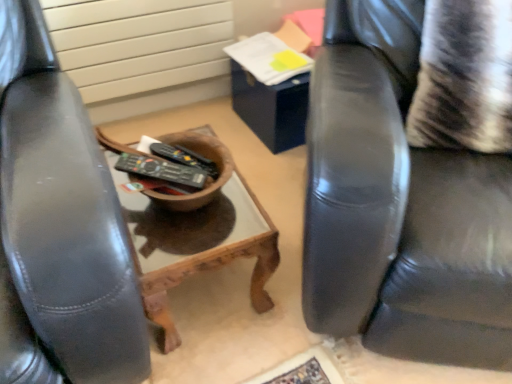
What do you see at coordinates (161, 170) in the screenshot? The image size is (512, 384). I see `black plastic remote control at center, which is the first remote control from front to back` at bounding box center [161, 170].

Describe the element at coordinates (464, 77) in the screenshot. I see `striped fabric pillow at right` at that location.

Describe the element at coordinates (199, 234) in the screenshot. The height and width of the screenshot is (384, 512). I see `woodenobject at center` at that location.

Image resolution: width=512 pixels, height=384 pixels. What are the coordinates of `black plastic remote control at center, the second remote control in the front-to-back sequence` in the screenshot? It's located at (184, 157).

Considering the positions of objects striped fabric pillow at right and woodenobject at center in the image provided, who is more to the left, striped fabric pillow at right or woodenobject at center?

Positioned to the left is woodenobject at center.

From the image's perspective, does striped fabric pillow at right appear higher than woodenobject at center?

Yes, from the image's perspective, striped fabric pillow at right is over woodenobject at center.

Choose the correct answer: Is striped fabric pillow at right inside woodenobject at center or outside it?

striped fabric pillow at right is spatially situated outside woodenobject at center.

Is white textured radiator at upper left further to the viewer compared to woodenobject at center?

Yes, it is.

Can you confirm if white textured radiator at upper left is shorter than woodenobject at center?

No, white textured radiator at upper left is not shorter than woodenobject at center.

Considering the relative positions of white textured radiator at upper left and woodenobject at center in the image provided, is white textured radiator at upper left to the left or to the right of woodenobject at center?

Clearly, white textured radiator at upper left is on the left of woodenobject at center in the image.

In order to click on table below the white textured radiator at upper left (from a real-world perspective) in this screenshot , I will do `click(199, 234)`.

Is white textured radiator at upper left bigger or smaller than black leather chair at right?

Clearly, white textured radiator at upper left is smaller in size than black leather chair at right.

Is white textured radiator at upper left looking in the opposite direction of black leather chair at right?

No, white textured radiator at upper left is not facing the opposite direction of black leather chair at right.

Is white textured radiator at upper left at the left side of black leather chair at right?

Indeed, white textured radiator at upper left is positioned on the left side of black leather chair at right.

Is the depth of black leather chair at right less than that of black plastic remote control at center, which is the first remote control from front to back?

That is True.

From the image's perspective, is black leather chair at right located above black plastic remote control at center, which ranks as the 2th remote control in back-to-front order?

Yes.

Is black leather chair at right looking in the opposite direction of black plastic remote control at center, which ranks as the 2th remote control in back-to-front order?

That's not correct — black leather chair at right is not looking away from black plastic remote control at center, which ranks as the 2th remote control in back-to-front order.

How different are the orientations of black leather chair at right and black plastic remote control at center, which is the first remote control from front to back, in degrees?

82 degrees separate the facing orientations of black leather chair at right and black plastic remote control at center, which is the first remote control from front to back.

Is white textured radiator at upper left far from black plastic remote control at center, the 1th remote control in the back-to-front sequence?

No, there isn't a large distance between white textured radiator at upper left and black plastic remote control at center, the 1th remote control in the back-to-front sequence.

Is white textured radiator at upper left aimed at black plastic remote control at center, the second remote control in the front-to-back sequence?

Yes, white textured radiator at upper left faces towards black plastic remote control at center, the second remote control in the front-to-back sequence.

Considering the relative sizes of white textured radiator at upper left and black plastic remote control at center, the second remote control in the front-to-back sequence, in the image provided, is white textured radiator at upper left taller than black plastic remote control at center, the second remote control in the front-to-back sequence,?

Yes, white textured radiator at upper left is taller than black plastic remote control at center, the second remote control in the front-to-back sequence.

Can you confirm if black leather chair at right is taller than black plastic remote control at center, the 1th remote control in the back-to-front sequence?

Yes.

Looking at this image, does black leather chair at right have a larger size compared to black plastic remote control at center, the second remote control in the front-to-back sequence?

Yes, black leather chair at right is bigger than black plastic remote control at center, the second remote control in the front-to-back sequence.

Does black leather chair at right turn towards black plastic remote control at center, the 1th remote control in the back-to-front sequence?

No, black leather chair at right is not aimed at black plastic remote control at center, the 1th remote control in the back-to-front sequence.

Is woodenobject at center not within black leather chair at right?

Yes, woodenobject at center is located beyond the bounds of black leather chair at right.

Does woodenobject at center turn towards black leather chair at right?

No, woodenobject at center is not turned towards black leather chair at right.

Consider the image. Is woodenobject at center shorter than black leather chair at right?

Correct, woodenobject at center is not as tall as black leather chair at right.

From a real-world perspective, which is physically above, woodenobject at center or black leather chair at right?

black leather chair at right, from a real-world perspective.

Locate an element on the screen. This screenshot has height=384, width=512. pillow to the right of woodenobject at center is located at coordinates (464, 77).

Find the location of a particular element. table below the white textured radiator at upper left (from the image's perspective) is located at coordinates (199, 234).

Estimate the real-world distances between objects in this image. Which object is further from black plastic remote control at center, the 1th remote control in the back-to-front sequence, black plastic remote control at center, which ranks as the 2th remote control in back-to-front order, or black leather chair at right?

Based on the image, black leather chair at right appears to be further to black plastic remote control at center, the 1th remote control in the back-to-front sequence.

When comparing their distances from striped fabric pillow at right, does black plastic remote control at center, which is the first remote control from front to back, or black plastic remote control at center, the second remote control in the front-to-back sequence, seem further?

black plastic remote control at center, which is the first remote control from front to back, is further to striped fabric pillow at right.

When comparing their distances from woodenobject at center, does striped fabric pillow at right or white textured radiator at upper left seem further?

white textured radiator at upper left is positioned further to the anchor woodenobject at center.

From the image, which object appears to be farther from woodenobject at center, black plastic remote control at center, the second remote control in the front-to-back sequence, or black leather chair at right?

black leather chair at right is positioned further to the anchor woodenobject at center.

Looking at the image, which one is located further to black leather chair at right, white textured radiator at upper left or striped fabric pillow at right?

white textured radiator at upper left is further to black leather chair at right.

Estimate the real-world distances between objects in this image. Which object is closer to woodenobject at center, black plastic remote control at center, which is the first remote control from front to back, or white textured radiator at upper left?

Among the two, black plastic remote control at center, which is the first remote control from front to back, is located nearer to woodenobject at center.

From the picture: Looking at the image, which one is located closer to black plastic remote control at center, the second remote control in the front-to-back sequence, black leather chair at right or woodenobject at center?

woodenobject at center lies closer to black plastic remote control at center, the second remote control in the front-to-back sequence, than the other object.

Considering their positions, is black leather chair at right positioned further to black plastic remote control at center, which ranks as the 2th remote control in back-to-front order, than white textured radiator at upper left?

Among the two, white textured radiator at upper left is located further to black plastic remote control at center, which ranks as the 2th remote control in back-to-front order.

Image resolution: width=512 pixels, height=384 pixels. In order to click on table between black leather chair at right and white textured radiator at upper left in the front-back direction in this screenshot , I will do `click(199, 234)`.

Find the location of `pillow between black plastic remote control at center, which is the first remote control from front to back, and black leather chair at right from left to right`. pillow between black plastic remote control at center, which is the first remote control from front to back, and black leather chair at right from left to right is located at coordinates point(464,77).

Where is `remote control that lies between white textured radiator at upper left and black plastic remote control at center, which is the first remote control from front to back, from top to bottom`? The image size is (512, 384). remote control that lies between white textured radiator at upper left and black plastic remote control at center, which is the first remote control from front to back, from top to bottom is located at coordinates (184, 157).

Find the location of a particular element. Image resolution: width=512 pixels, height=384 pixels. pillow situated between woodenobject at center and black leather chair at right from left to right is located at coordinates (464, 77).